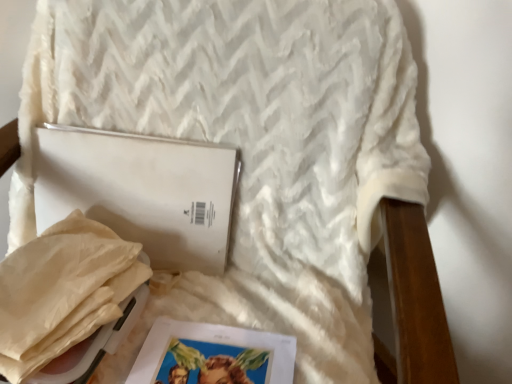
Question: Is beige paper bag at lower left wider or thinner than matte paper magazine at lower center?

Choices:
 (A) wide
 (B) thin

Answer: (B)

Question: From a real-world perspective, relative to matte paper magazine at lower center, is beige paper bag at lower left vertically above or below?

Choices:
 (A) below
 (B) above

Answer: (B)

Question: Which of these objects is positioned closest to the white matte journal at center?

Choices:
 (A) matte paper magazine at lower center
 (B) beige paper bag at lower left

Answer: (B)

Question: Which of these objects is positioned farthest from the matte paper magazine at lower center?

Choices:
 (A) white matte journal at center
 (B) beige paper bag at lower left

Answer: (A)